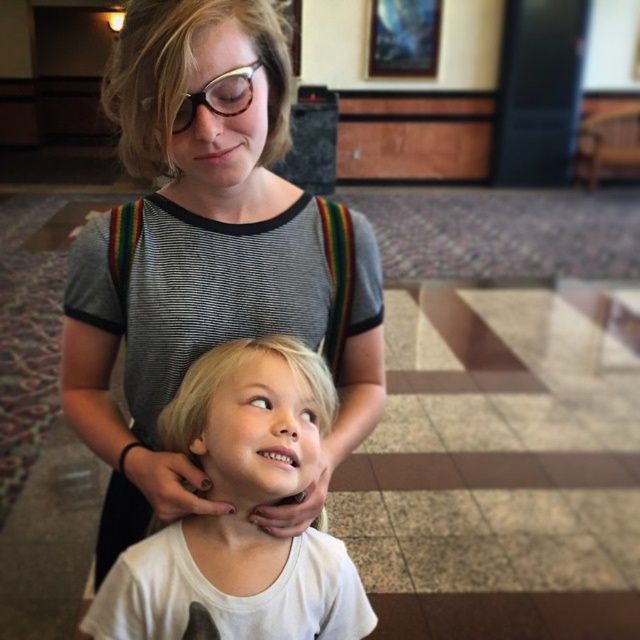
Question: Which of the following is the farthest from the observer?

Choices:
 (A) (152, 324)
 (B) (224, 93)
 (C) (324, 401)

Answer: (A)

Question: From the image, what is the correct spatial relationship of matte gray shirt at center in relation to white matte shirt at center?

Choices:
 (A) below
 (B) above

Answer: (B)

Question: Which of the following is the closest to the observer?

Choices:
 (A) white matte shirt at center
 (B) matte gray shirt at center

Answer: (B)

Question: Is matte gray shirt at center to the right of matte black glasses at upper center from the viewer's perspective?

Choices:
 (A) no
 (B) yes

Answer: (A)

Question: Among these points, which one is nearest to the camera?

Choices:
 (A) (220, 115)
 (B) (224, 563)
 (C) (368, 349)

Answer: (A)

Question: Can you confirm if matte gray shirt at center is positioned above matte black glasses at upper center?

Choices:
 (A) no
 (B) yes

Answer: (A)